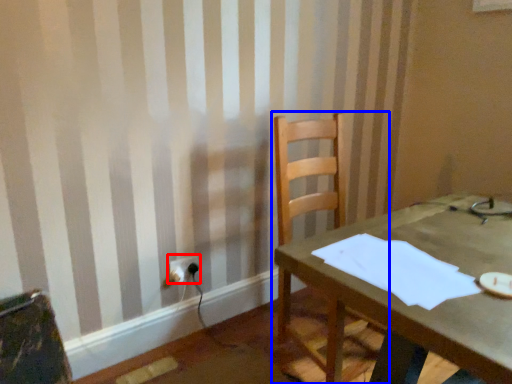
Question: Which object appears farthest to the camera in this image, electric outlet (highlighted by a red box) or chair (highlighted by a blue box)?

Choices:
 (A) electric outlet
 (B) chair

Answer: (A)